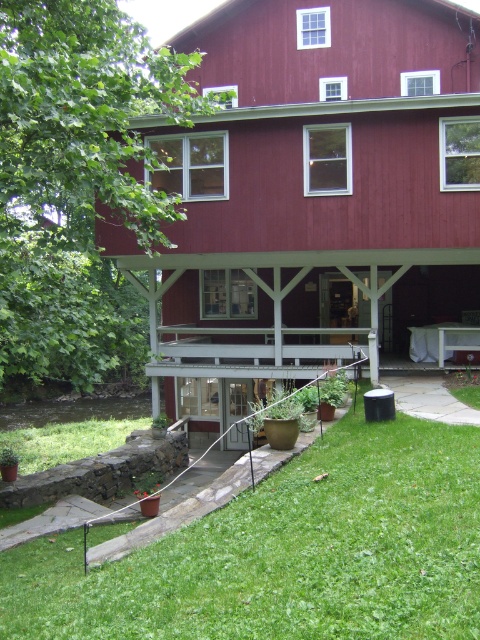
The width and height of the screenshot is (480, 640). What do you see at coordinates (311, 196) in the screenshot?
I see `smooth red barn at center` at bounding box center [311, 196].

In the scene shown: Can you confirm if smooth red barn at center is bigger than green grass at lower center?

Correct, smooth red barn at center is larger in size than green grass at lower center.

This screenshot has width=480, height=640. Find the location of `smooth red barn at center`. smooth red barn at center is located at coordinates (311, 196).

Find the location of `smooth red barn at center`. smooth red barn at center is located at coordinates (311, 196).